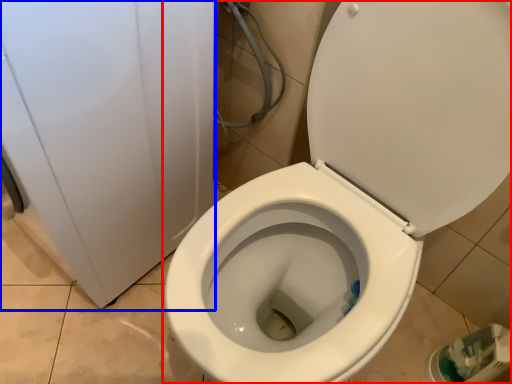
Question: Which point is further to the camera, toilet (highlighted by a red box) or porcelain (highlighted by a blue box)?

Choices:
 (A) toilet
 (B) porcelain

Answer: (B)